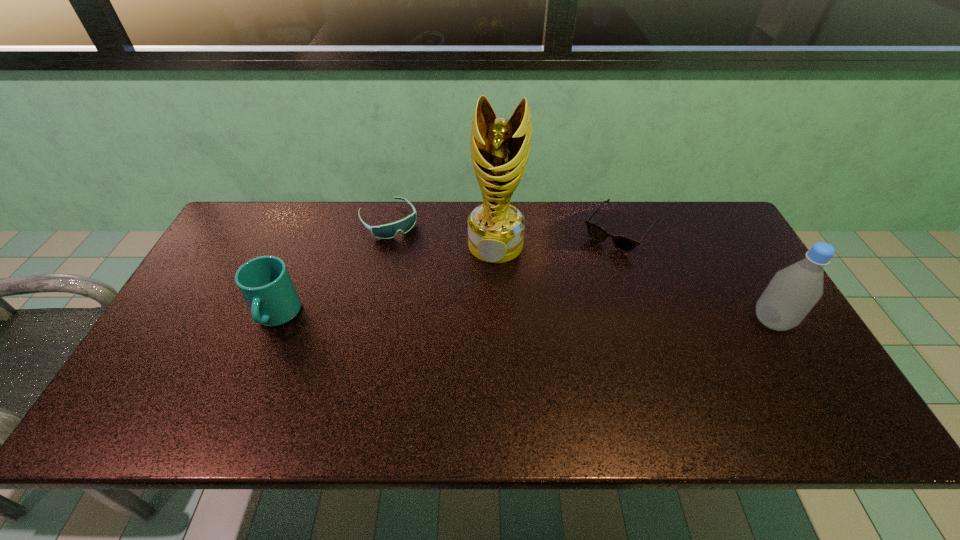
Identify the location of free area in between the sunglasses and the fourth shortest object. The height and width of the screenshot is (540, 960). (696, 276).

In order to click on free space between the sunglasses and the leftmost object in this screenshot , I will do `click(448, 273)`.

You are a GUI agent. You are given a task and a screenshot of the screen. Output one action in this format:
    pyautogui.click(x=<x>, y=<y>)
    Task: Click on the vacant area that lies between the third tallest object and the goggles
    The image size is (960, 540).
    Given the screenshot: What is the action you would take?
    pyautogui.click(x=333, y=268)

I want to click on empty location between the sunglasses and the award, so click(558, 238).

Image resolution: width=960 pixels, height=540 pixels. Identify the location of free spot between the leftmost object and the third object from right to left. (386, 280).

Where is `unoccupied position between the fourth object from right to left and the tallest object`? unoccupied position between the fourth object from right to left and the tallest object is located at coordinates (443, 232).

This screenshot has width=960, height=540. Find the location of `empty location between the leftmost object and the goggles`. empty location between the leftmost object and the goggles is located at coordinates 333,268.

You are a GUI agent. You are given a task and a screenshot of the screen. Output one action in this format:
    pyautogui.click(x=<x>, y=<y>)
    Task: Click on the free spot between the fourth shortest object and the fourth object from left to right
    This screenshot has height=540, width=960.
    Given the screenshot: What is the action you would take?
    pyautogui.click(x=696, y=276)

Locate an element on the screen. This screenshot has width=960, height=540. vacant area that lies between the second object from left to right and the fourth shortest object is located at coordinates (580, 271).

Image resolution: width=960 pixels, height=540 pixels. In order to click on empty space that is in between the cup and the goggles in this screenshot , I will do `click(333, 268)`.